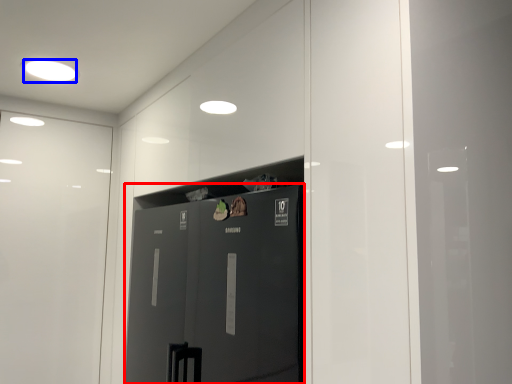
Question: Which point is closer to the camera, door (highlighted by a red box) or lighting (highlighted by a blue box)?

Choices:
 (A) door
 (B) lighting

Answer: (A)